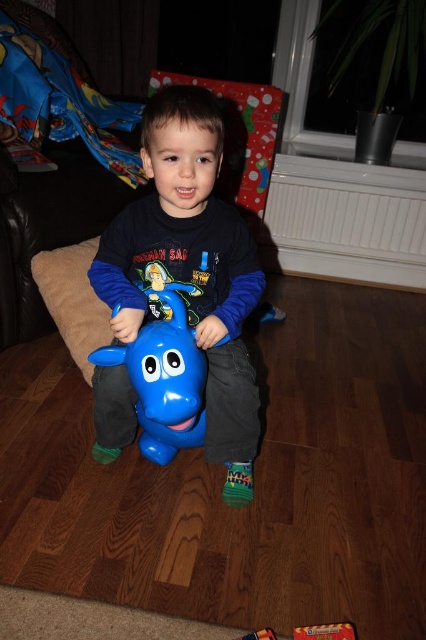
Can you confirm if matte plastic toy horse at center is positioned above blue rubber horse at center?

Yes, matte plastic toy horse at center is above blue rubber horse at center.

Does matte plastic toy horse at center come in front of blue rubber horse at center?

That is False.

Find the location of a particular element. Image resolution: width=426 pixels, height=640 pixels. matte plastic toy horse at center is located at coordinates point(190,268).